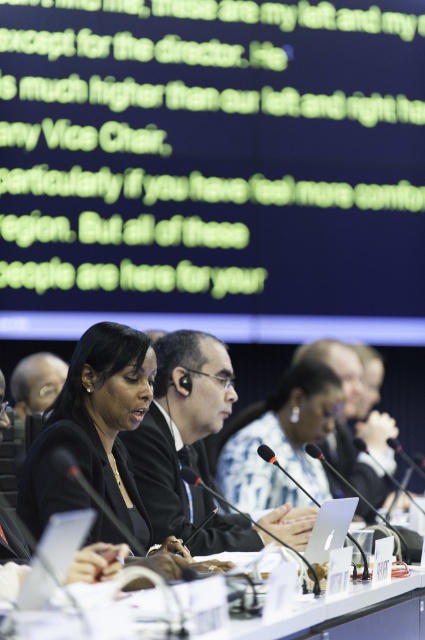
You are a photographer taking a picture of the conference table setup. You need to ensure that the black glossy hair at center is visible in the frame. Given that your camera is focused on the point at coordinates (93, 429), will the black glossy hair at center be in focus?

Yes, the black glossy hair at center is located exactly at the point (93, 429) where the camera is focused, so it will be in focus.

You are a photographer taking a picture of the conference table setup. You notice the black glossy hair at center and the white plastic table at center. Which object is taller in the scene?

The black glossy hair at center is taller than the white plastic table at center according to the description.

You are a photographer standing at the back of the conference room. You want to take a closeup shot of the black glossy hair at center. What is the exact coordinate where you should focus your camera?

The exact coordinate to focus on is point (93, 429) to capture the black glossy hair at center.